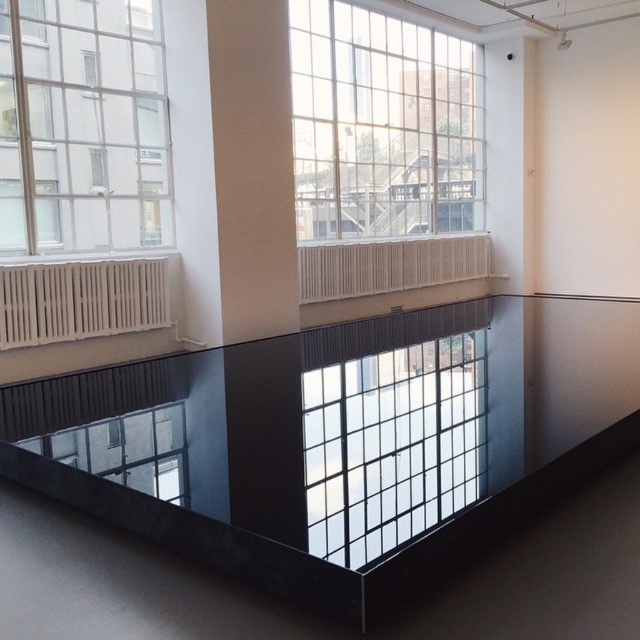
You are planning to place a large potted plant on the transparent glass table at center and the transparent glass window at center. Which surface can accommodate the plant without overhanging the edges?

The transparent glass window at center can accommodate the large potted plant without overhanging the edges because it has a larger size compared to the transparent glass table at center.

You are a delivery person with a package that is 4 meters long. You need to move it from the transparent glass table at center to the clear glass window at upper left. Can you move the package through the space between them without bending or shortening it?

The distance between the transparent glass table at center and the clear glass window at upper left is 4.20 meters. Since the package is 4 meters long, it can be moved through the space as the distance is sufficient.